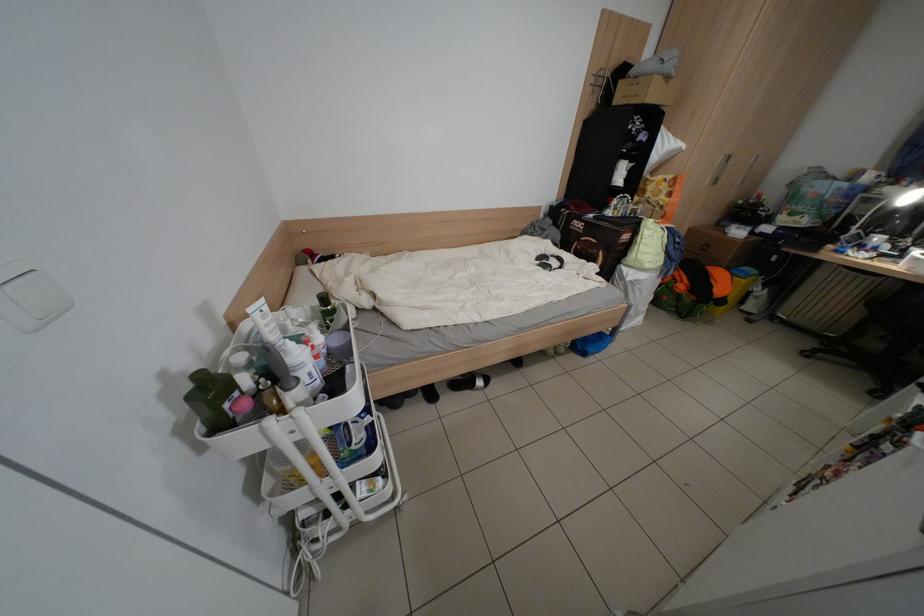
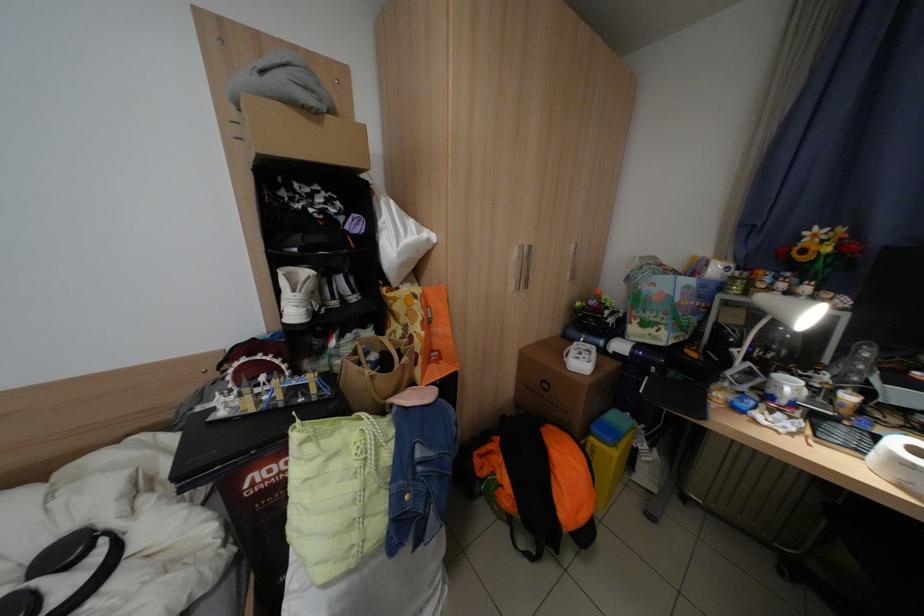
In the second image, find the point that corresponds to point 715,249 in the first image.

(555, 387)